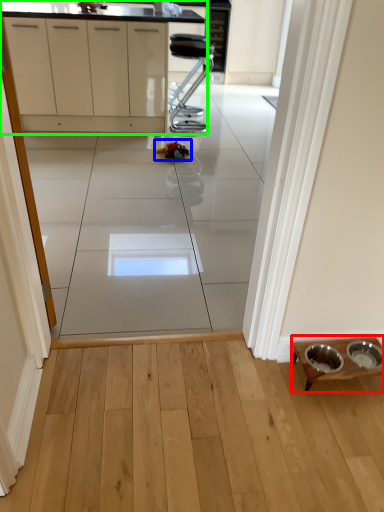
Question: Which object is positioned closest to table (highlighted by a red box)? Select from toy (highlighted by a blue box) and cabinetry (highlighted by a green box).

Choices:
 (A) toy
 (B) cabinetry

Answer: (A)